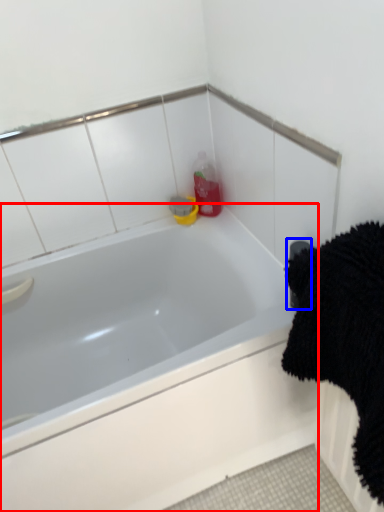
Question: Which point is closer to the camera, bathtub (highlighted by a red box) or towel bar (highlighted by a blue box)?

Choices:
 (A) bathtub
 (B) towel bar

Answer: (A)